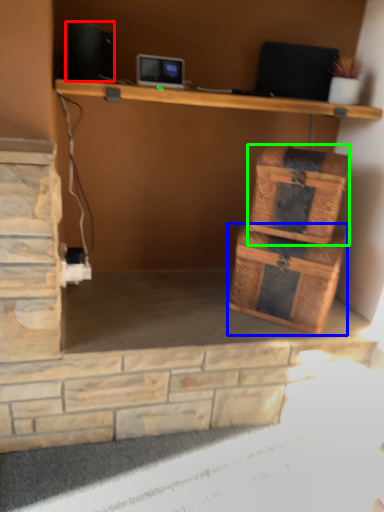
Question: Which is nearer to the speaker (highlighted by a red box)? storage box (highlighted by a blue box) or basket (highlighted by a green box).

Choices:
 (A) storage box
 (B) basket

Answer: (B)